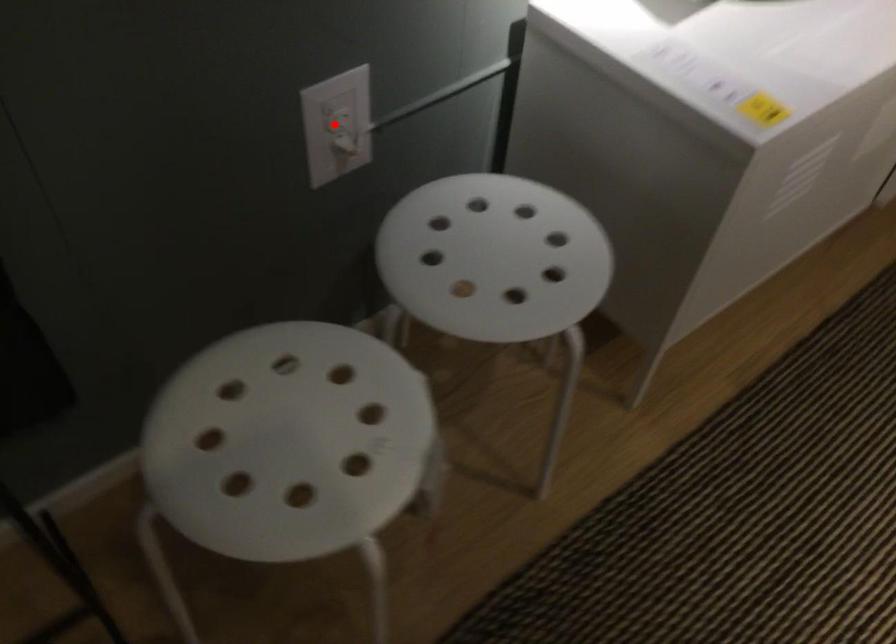
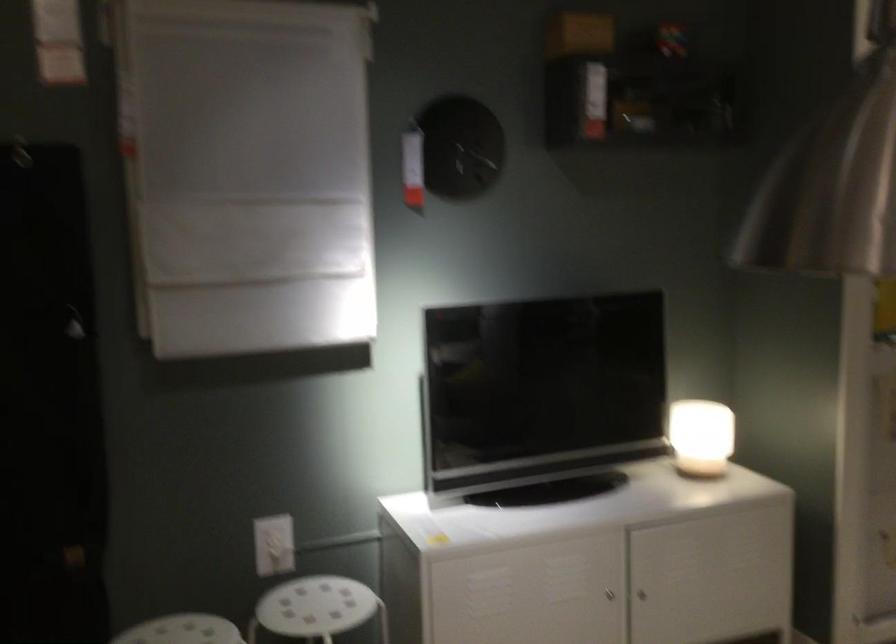
Question: I am providing you with two images of the same scene from different viewpoints. A red point is shown in image1. For the corresponding object point in image2, is it positioned nearer or farther from the camera?

Choices:
 (A) Nearer
 (B) Farther

Answer: (B)